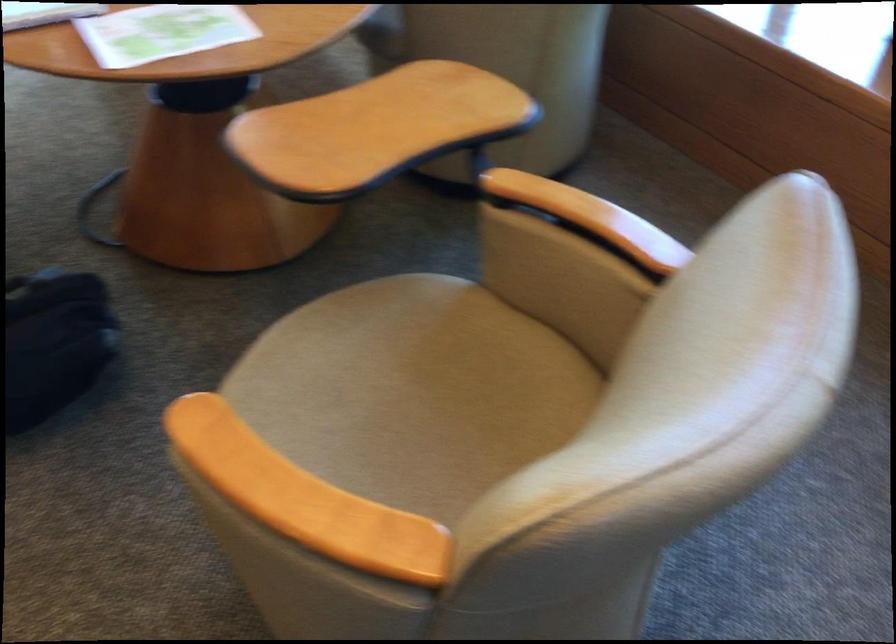
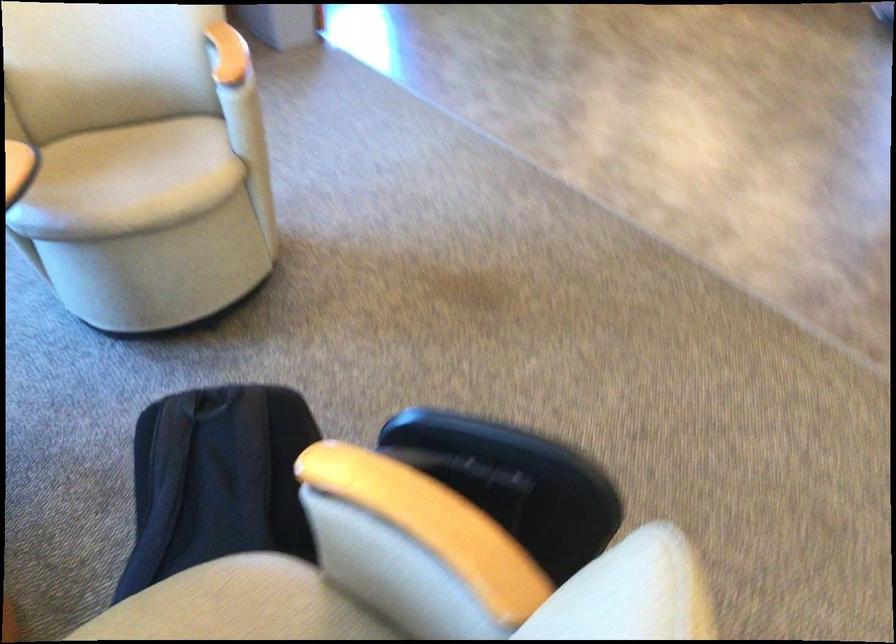
The point at [210,422] is marked in the first image. Where is the corresponding point in the second image?

(127, 180)